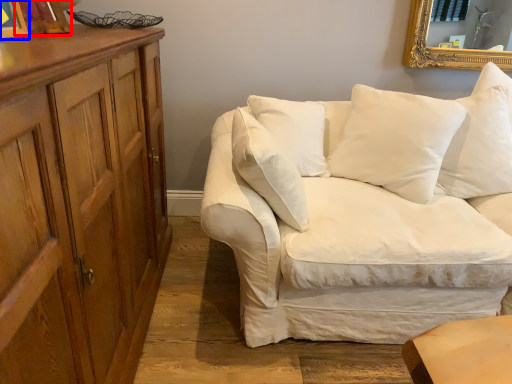
Question: Which point is further to the camera, picture frame (highlighted by a red box) or picture frame (highlighted by a blue box)?

Choices:
 (A) picture frame
 (B) picture frame

Answer: (A)